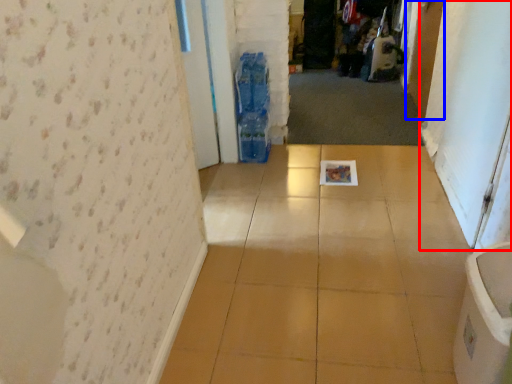
Question: Which point is closer to the camera, screen door (highlighted by a red box) or door (highlighted by a blue box)?

Choices:
 (A) screen door
 (B) door

Answer: (A)